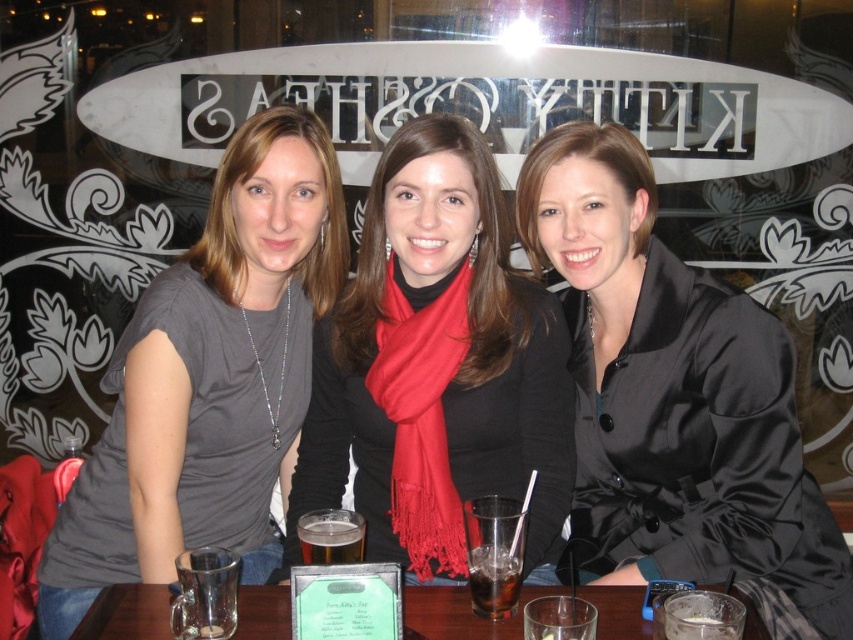
Is matte black scarf at center to the right of clear glass table at center from the viewer's perspective?

Incorrect, matte black scarf at center is not on the right side of clear glass table at center.

Is point (383, 552) in front of point (404, 588)?

No, (383, 552) is behind (404, 588).

At what (x,y) coordinates should I click in order to perform the action: click on matte black scarf at center. Please return your answer as a coordinate pair (x, y). Looking at the image, I should click on (436, 365).

Which of these two, matte black scarf at center or translucent glass beer at center, stands shorter?

translucent glass beer at center is shorter.

Does matte black scarf at center have a lesser height compared to translucent glass beer at center?

In fact, matte black scarf at center may be taller than translucent glass beer at center.

This screenshot has height=640, width=853. Find the location of `matte black scarf at center`. matte black scarf at center is located at coordinates (436, 365).

Is point (486, 241) more distant than point (201, 310)?

Yes, point (486, 241) is farther from viewer.

Who is more distant from viewer, (419, 285) or (299, 125)?

Point (299, 125)

The height and width of the screenshot is (640, 853). Find the location of `matte black scarf at center`. matte black scarf at center is located at coordinates [x=436, y=365].